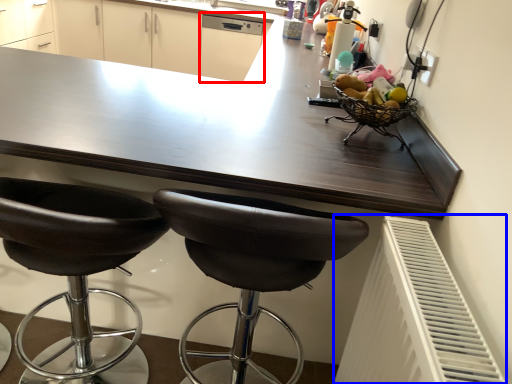
Question: Which of the following is the closest to the observer, dish washer (highlighted by a red box) or radiator (highlighted by a blue box)?

Choices:
 (A) dish washer
 (B) radiator

Answer: (B)